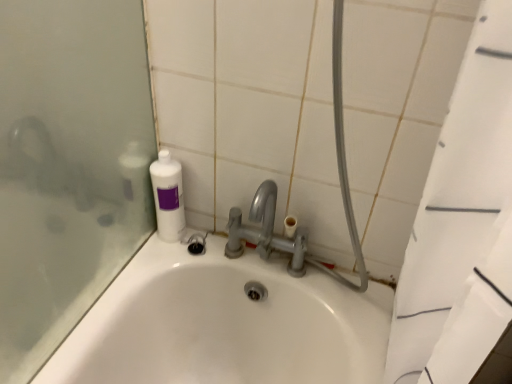
The width and height of the screenshot is (512, 384). What do you see at coordinates (168, 196) in the screenshot?
I see `white glossy bottle at upper left` at bounding box center [168, 196].

What is the approximate width of white glossy bottle at upper left?

white glossy bottle at upper left is 9.02 centimeters wide.

Image resolution: width=512 pixels, height=384 pixels. Identify the location of white glossy bottle at upper left. (168, 196).

What are the coordinates of `white glossy bottle at upper left` in the screenshot? It's located at (168, 196).